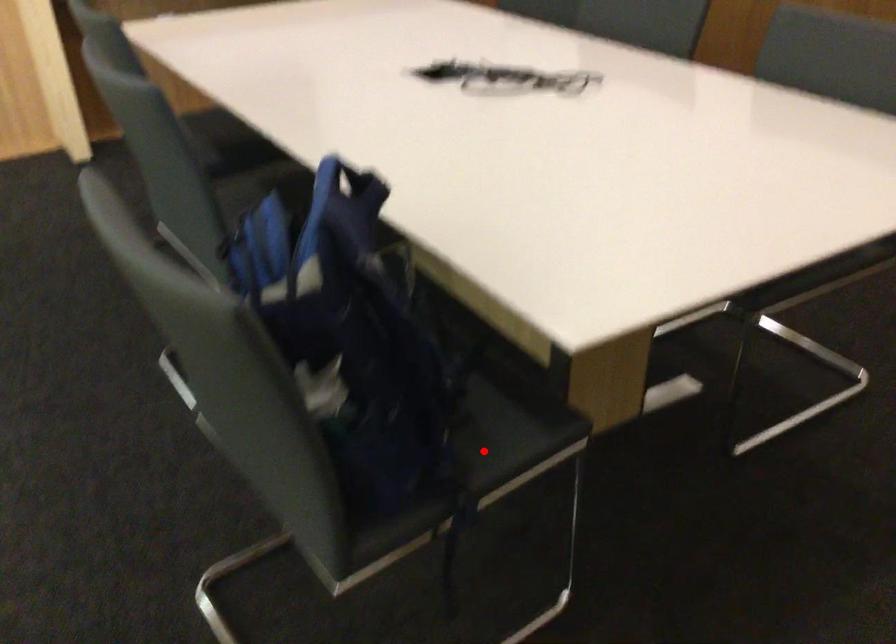
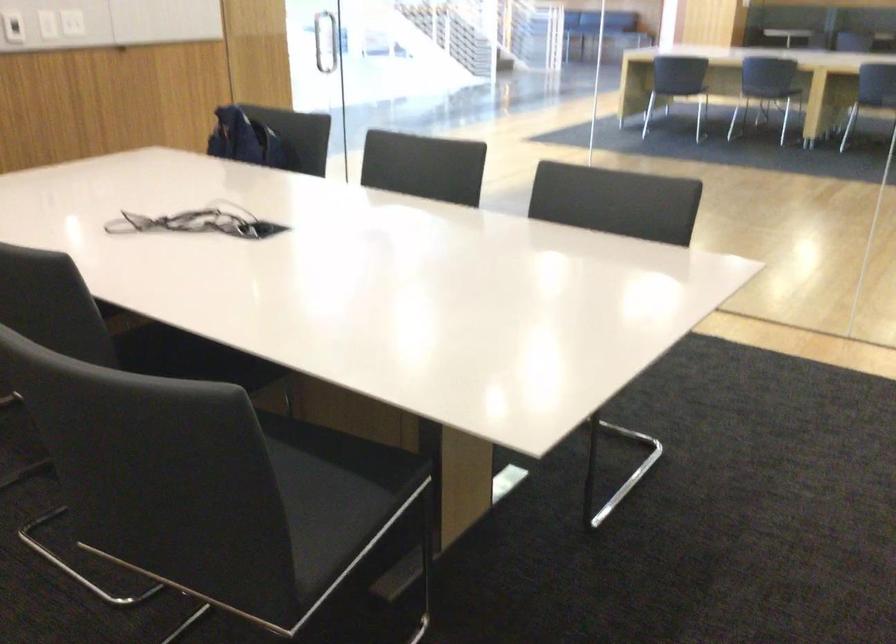
Question: I am providing you with two images of the same scene from different viewpoints. A red point is marked on the first image. Is the red point's position out of view in image 2?

Choices:
 (A) Yes
 (B) No

Answer: (A)